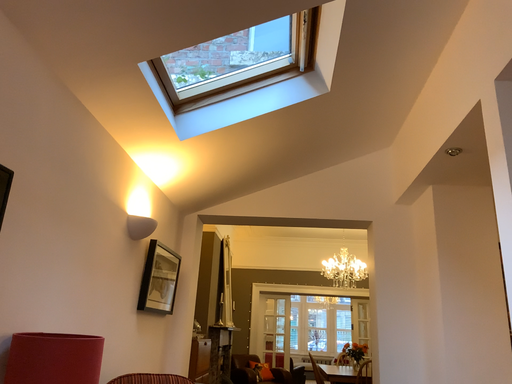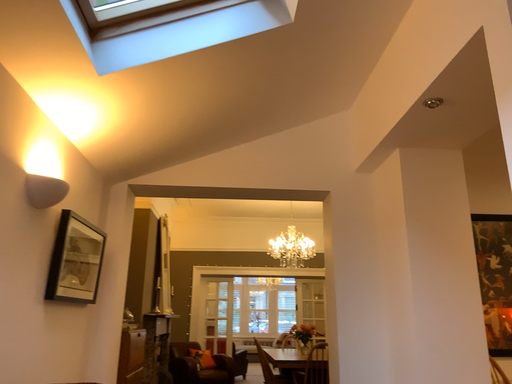
Question: How did the camera likely rotate when shooting the video?

Choices:
 (A) rotated right
 (B) rotated left

Answer: (A)